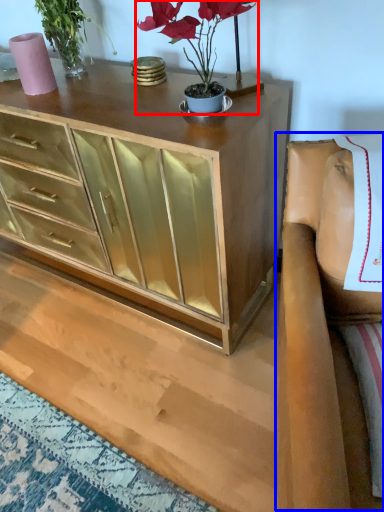
Question: Which object is closer to the camera taking this photo, houseplant (highlighted by a red box) or armchair (highlighted by a blue box)?

Choices:
 (A) houseplant
 (B) armchair

Answer: (B)